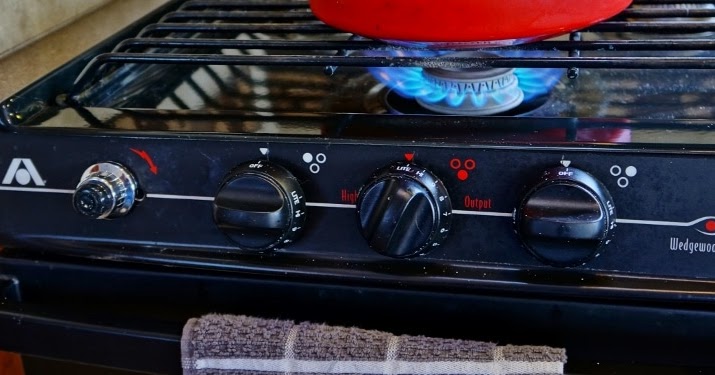
I want to click on turning knob, so click(x=114, y=185).